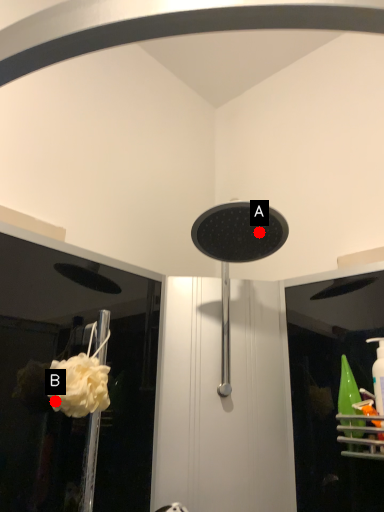
Question: Two points are circled on the image, labeled by A and B beside each circle. Which of the following is the closest to the observer?

Choices:
 (A) A is closer
 (B) B is closer

Answer: (B)